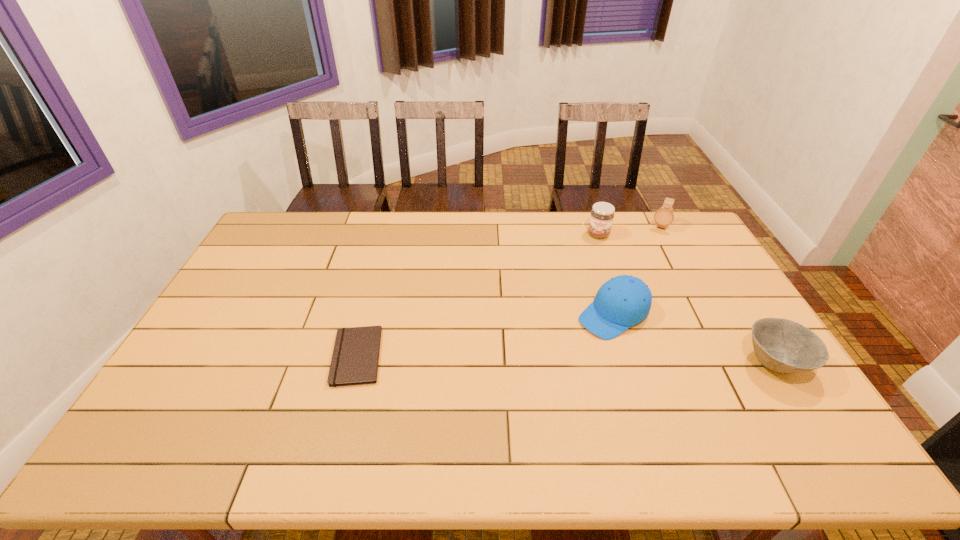
Locate an element on the screen. The width and height of the screenshot is (960, 540). free region located on the front label of the jam is located at coordinates (590, 284).

Find the location of a particular element. vacant space positioned 0.400m on the front-facing side of the cap is located at coordinates (483, 403).

You are a GUI agent. You are given a task and a screenshot of the screen. Output one action in this format:
    pyautogui.click(x=<x>, y=<y>)
    Task: Click on the free space located 0.120m on the front-facing side of the cap
    
    Given the screenshot: What is the action you would take?
    pyautogui.click(x=560, y=350)

Image resolution: width=960 pixels, height=540 pixels. I want to click on free region located on the front-facing side of the cap, so click(520, 376).

Locate an element on the screen. This screenshot has width=960, height=540. vacant space situated on the face of the watch is located at coordinates (652, 246).

This screenshot has height=540, width=960. What are the coordinates of `vacant region located 0.080m on the face of the watch` in the screenshot? It's located at (654, 244).

Where is `vacant position located on the face of the watch`? Image resolution: width=960 pixels, height=540 pixels. vacant position located on the face of the watch is located at coordinates (632, 294).

The height and width of the screenshot is (540, 960). I want to click on jam situated at the far edge, so click(x=602, y=214).

You are a GUI agent. You are given a task and a screenshot of the screen. Output one action in this format:
    pyautogui.click(x=<x>, y=<y>)
    Task: Click on the watch present at the far edge
    
    Given the screenshot: What is the action you would take?
    pyautogui.click(x=664, y=216)

Find the location of a particular element. object that is at the near edge is located at coordinates (784, 346).